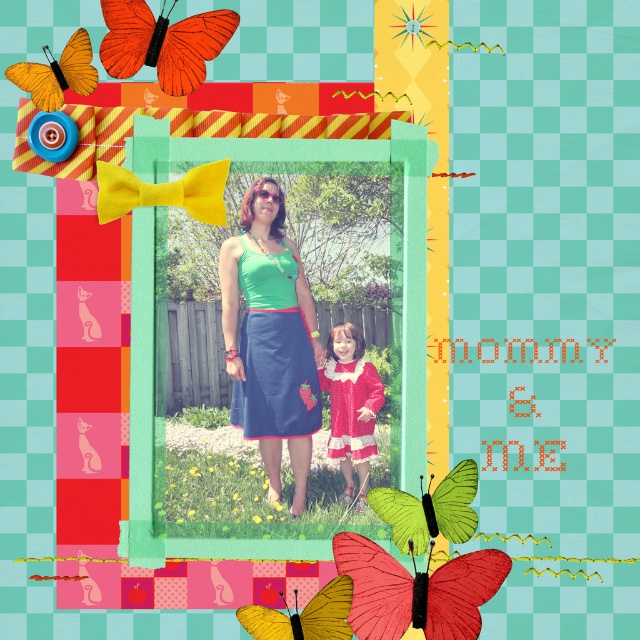
Looking at the vibrant digital collage, you notice two butterflies in the colorful frame. The red matte butterfly at center and the orange matte butterfly at upper left. Which one is positioned to the right of the other?

The red matte butterfly at center is positioned to the right of the orange matte butterfly at upper left.

What object is located at the coordinates point (400,234) in the image?

The point (400,234) corresponds to the green fabric picture frame at center.

Please describe the exact location of the matte green fabric dress at center in the image using coordinate points.

The matte green fabric dress at center is located at coordinate point (269,339).